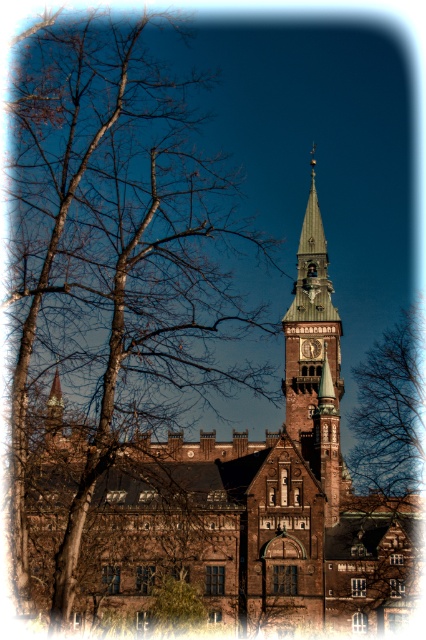
Question: Which object appears closest to the camera in this image?

Choices:
 (A) green wooden clock tower at upper center
 (B) bare branches at center
 (C) metallic clock at center
 (D) brown textured tree at left

Answer: (D)

Question: From the image, what is the correct spatial relationship of brown textured tree at left in relation to bare branches at center?

Choices:
 (A) right
 (B) left

Answer: (B)

Question: Does brown textured tree at left have a greater width compared to bare branches at center?

Choices:
 (A) yes
 (B) no

Answer: (A)

Question: Among these points, which one is farthest from the camera?

Choices:
 (A) (308, 339)
 (B) (394, 490)

Answer: (B)

Question: Does brown textured tree at left have a greater width compared to green wooden clock tower at upper center?

Choices:
 (A) no
 (B) yes

Answer: (B)

Question: Which is farther from the bare branches at center?

Choices:
 (A) green wooden clock tower at upper center
 (B) metallic clock at center

Answer: (B)